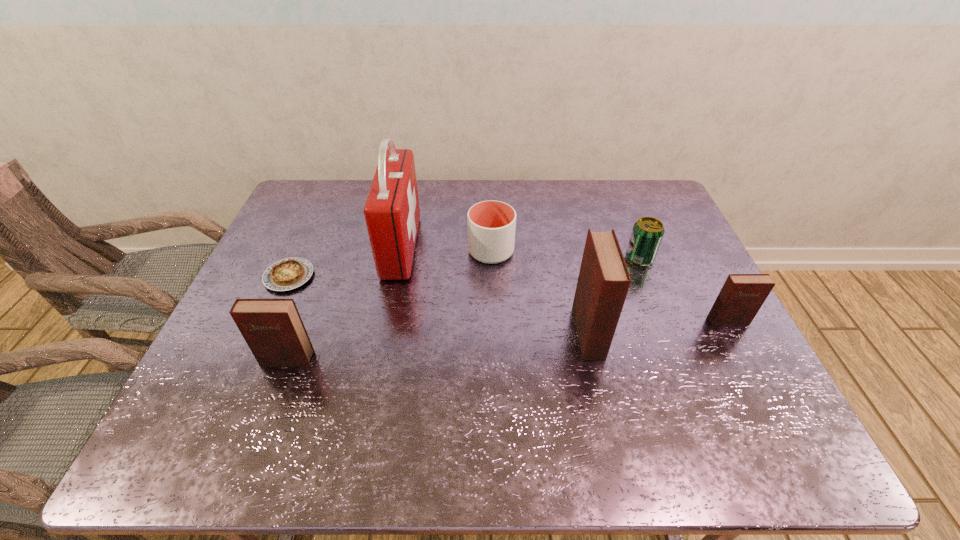
Please point a space for a new diary to maintain equal intervals. Please provide its 2D coordinates. Your answer should be formatted as a tuple, i.e. [(x, y)], where the tuple contains the x and y coordinates of a point satisfying the conditions above.

[(442, 346)]